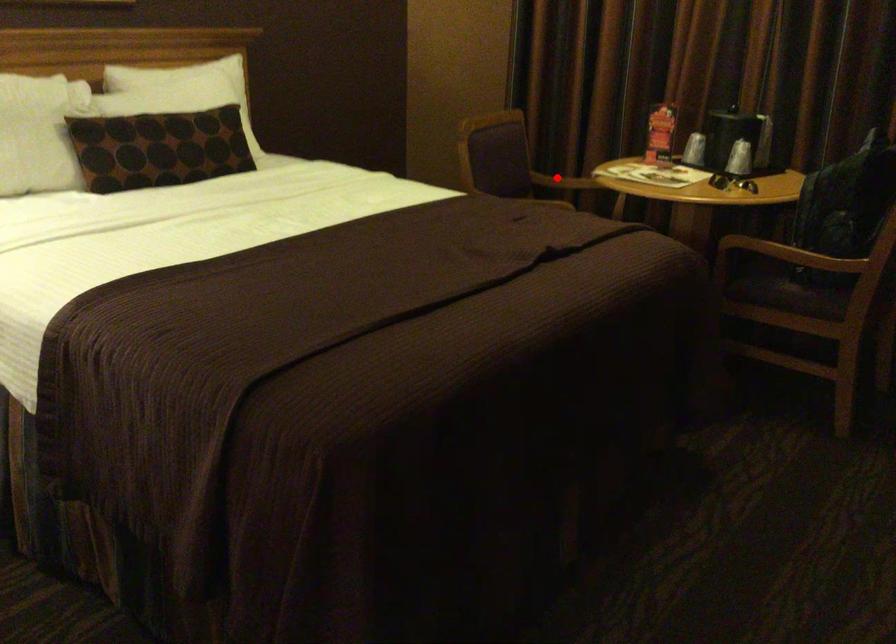
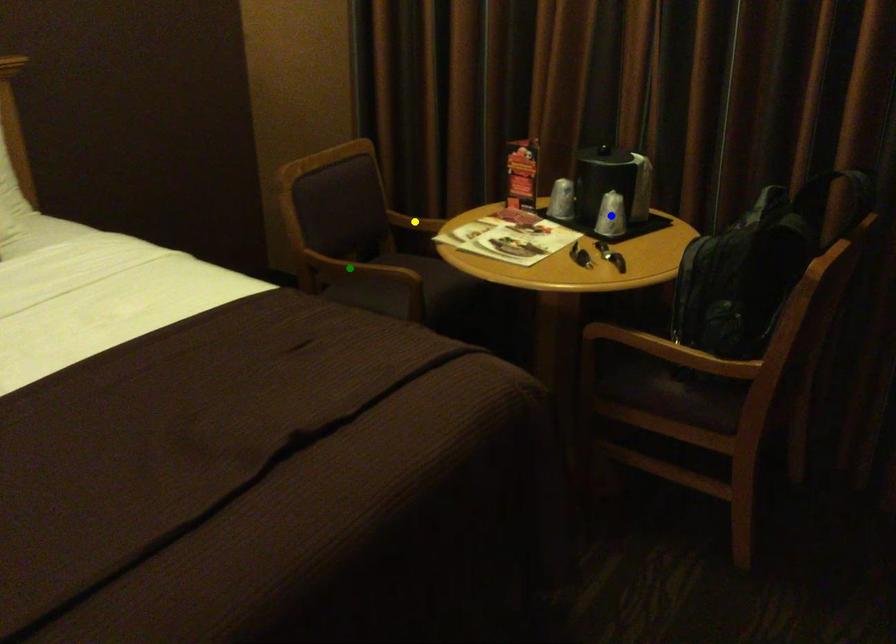
Question: I am providing you with two images of the same scene from different viewpoints. A red point is marked on the first image. You are given multiple points on the second image. Which spot in image 2 lines up with the point in image 1?

Choices:
 (A) yellow point
 (B) green point
 (C) blue point

Answer: (A)